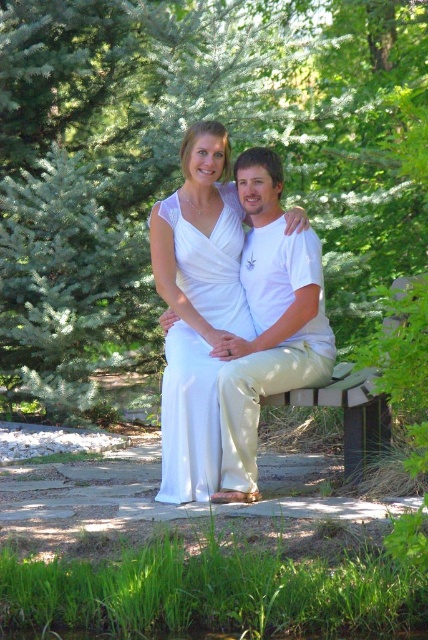
You are a photographer planning to take a portrait of the two people sitting on the wooden park bench at center. The white satin dress at center is covering part of the bench. Should you adjust the dress to show the bench clearly in the photo?

The white satin dress at center is positioned over the wooden park bench at center, so adjusting it would reveal the bench more clearly in the photo.

You are planning to take a photo of the wooden park bench at center and the green leafy tree at upper center. Which object should you focus on first if you want to capture both in a single frame without moving the camera?

The green leafy tree at upper center is taller than the wooden park bench at center, so you should focus on the green leafy tree at upper center first to ensure it fits within the frame.

You are a photographer planning to take a portrait of the two people sitting on the wooden park bench at center. You want to ensure the white satin dress at center is clearly visible in the photo. Based on their sizes, is the dress likely to be easily noticeable compared to the bench?

The white satin dress at center is thinner than wooden park bench at center, so the dress is narrower and may be less dominant in the frame compared to the bench. However, its bright white color should still make it stand out against the darker wooden bench.